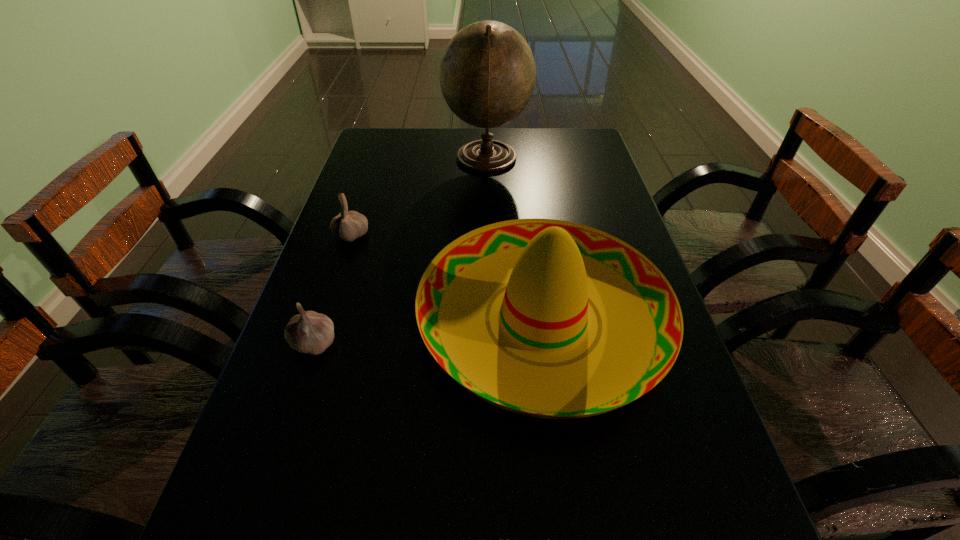
Find the location of `the fourth closest object to the sombrero`. the fourth closest object to the sombrero is located at coordinates (487, 74).

Locate an element on the screen. The width and height of the screenshot is (960, 540). vacant region that satisfies the following two spatial constraints: 1. on the front-facing side of the globe; 2. on the right side of the sombrero is located at coordinates (491, 318).

Where is `vacant area in the image that satisfies the following two spatial constraints: 1. on the front-facing side of the fourth shortest object; 2. on the left side of the globe`? vacant area in the image that satisfies the following two spatial constraints: 1. on the front-facing side of the fourth shortest object; 2. on the left side of the globe is located at coordinates (491, 318).

Identify the location of vacant space that satisfies the following two spatial constraints: 1. on the front side of the fourth shortest object; 2. on the left side of the farther garlic. This screenshot has width=960, height=540. (324, 318).